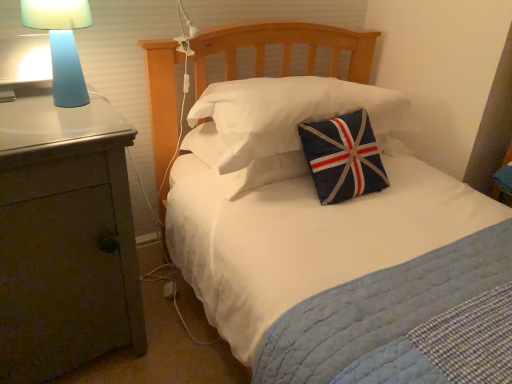
Question: From a real-world perspective, relative to matte gray nightstand at left, is blue fabric pillow at center, placed as the 2th pillow when sorted from top to bottom, vertically above or below?

Choices:
 (A) below
 (B) above

Answer: (B)

Question: Would you say blue fabric pillow at center, placed as the 2th pillow when sorted from top to bottom, is to the left or to the right of matte gray nightstand at left in the picture?

Choices:
 (A) left
 (B) right

Answer: (B)

Question: Which object is positioned closest to the blue matte lamp at left?

Choices:
 (A) matte gray nightstand at left
 (B) blue fabric pillow at center, placed as the 2th pillow when sorted from top to bottom
 (C) navy blue fabric pillow at center, positioned as the first pillow in top-to-bottom order

Answer: (A)

Question: Based on their relative distances, which object is farther from the blue fabric pillow at center, placed as the 2th pillow when sorted from top to bottom?

Choices:
 (A) navy blue fabric pillow at center, which appears as the 2th pillow when ordered from the bottom
 (B) matte gray nightstand at left
 (C) blue matte lamp at left

Answer: (C)